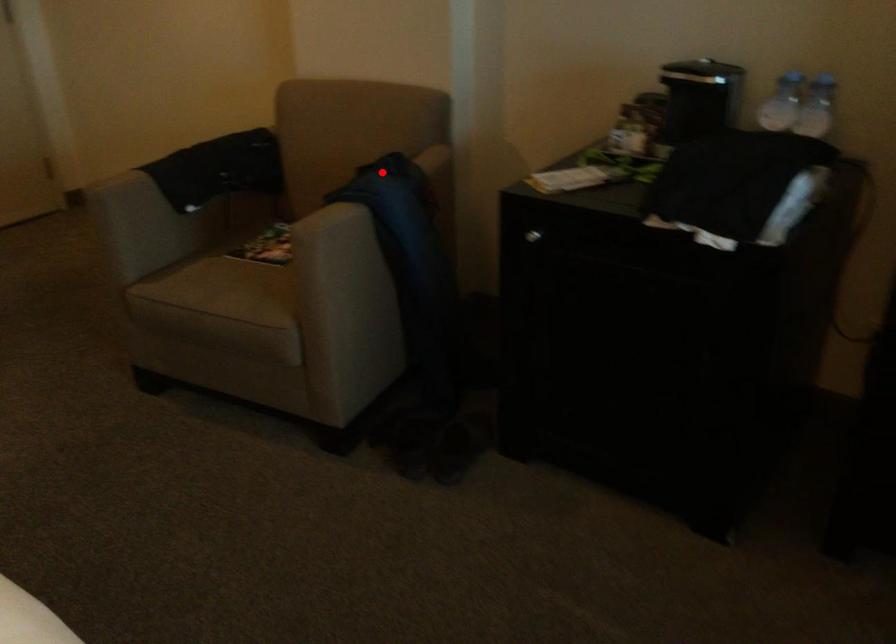
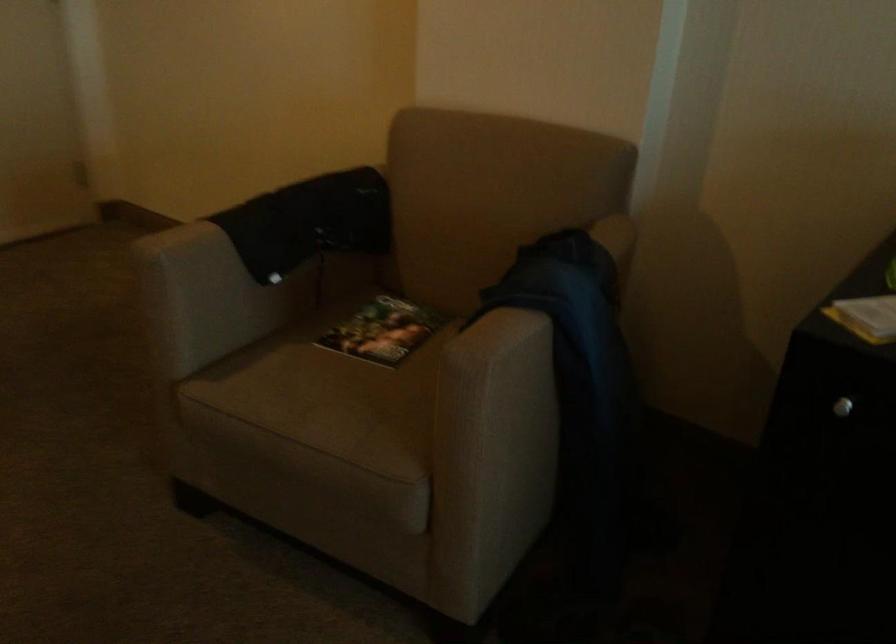
The point at the highlighted location is marked in the first image. Where is the corresponding point in the second image?

(564, 261)